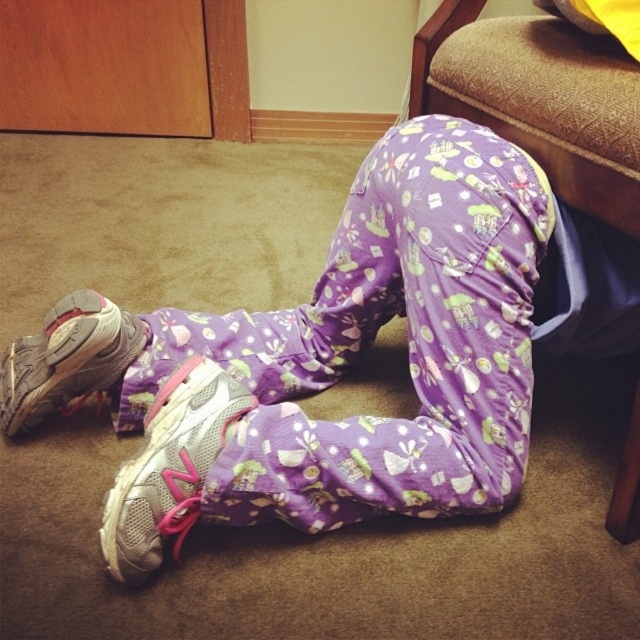
Question: Does silver mesh shoe at lower left appear on the right side of silver mesh sneaker at lower left?

Choices:
 (A) yes
 (B) no

Answer: (A)

Question: Which point is farther to the camera?

Choices:
 (A) silver mesh sneaker at lower left
 (B) brown fabric chair at lower right

Answer: (A)

Question: Among these points, which one is nearest to the camera?

Choices:
 (A) click(109, 374)
 (B) click(163, 449)
 (C) click(620, 520)
 (D) click(522, 349)

Answer: (B)

Question: Estimate the real-world distances between objects in this image. Which object is farther from the silver mesh shoe at lower left?

Choices:
 (A) purple cotton pants at lower center
 (B) brown fabric chair at lower right

Answer: (B)

Question: Can you confirm if purple cotton pants at lower center is positioned below silver mesh sneaker at lower left?

Choices:
 (A) yes
 (B) no

Answer: (B)

Question: Can you confirm if silver mesh shoe at lower left is smaller than brown fabric chair at lower right?

Choices:
 (A) no
 (B) yes

Answer: (B)